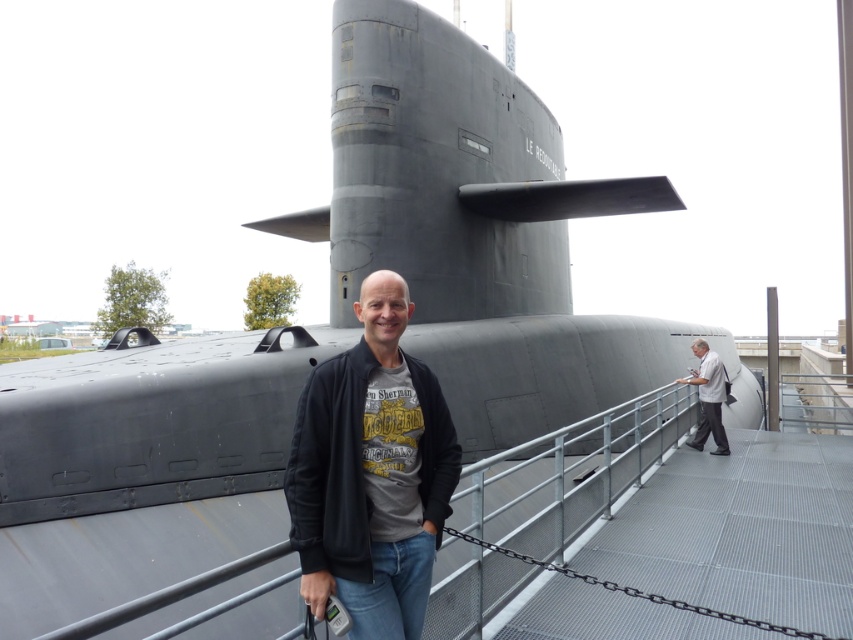
Question: Observing the image, what is the correct spatial positioning of black matte jacket at center in reference to gray matte jacket at right?

Choices:
 (A) right
 (B) left

Answer: (B)

Question: Among these objects, which one is farthest from the camera?

Choices:
 (A) black matte jacket at center
 (B) gray matte jacket at right

Answer: (B)

Question: Is black matte jacket at center in front of gray matte jacket at right?

Choices:
 (A) no
 (B) yes

Answer: (B)

Question: Does black matte jacket at center have a smaller size compared to gray matte jacket at right?

Choices:
 (A) no
 (B) yes

Answer: (B)